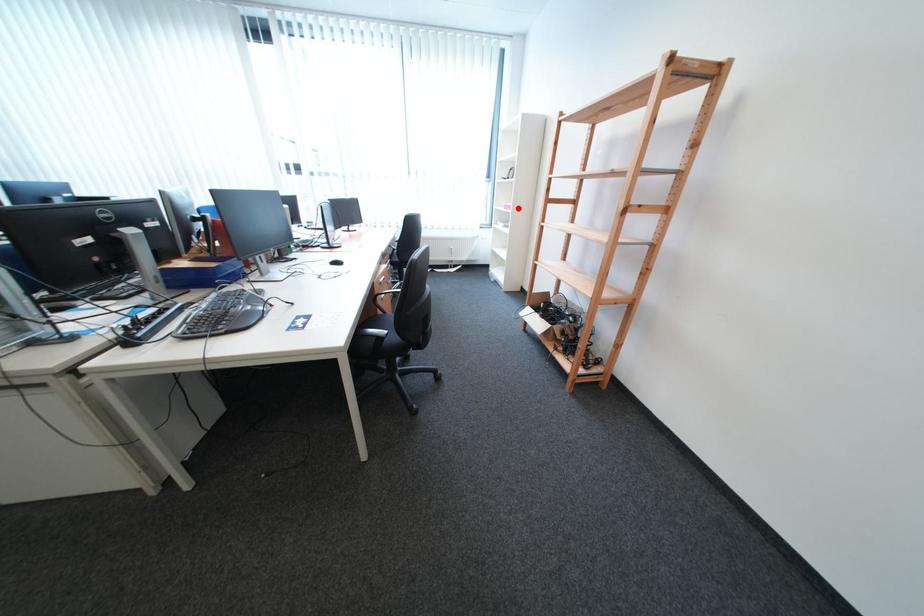
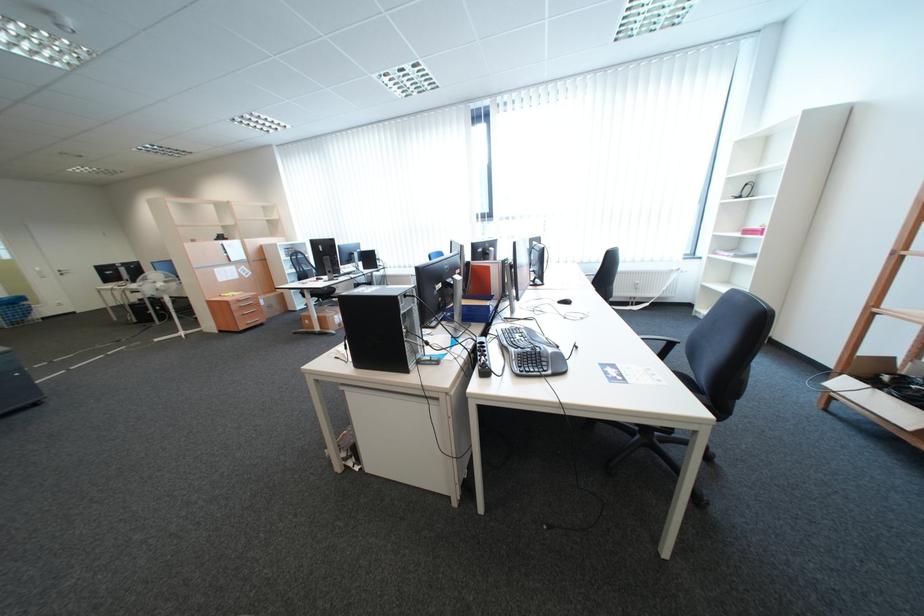
Question: I am providing you with two images of the same scene from different viewpoints. Image1 has a red point marked. In image2, the corresponding 3D location appears at what relative position? Reply with the corresponding letter.

Choices:
 (A) Closer
 (B) Farther

Answer: (B)